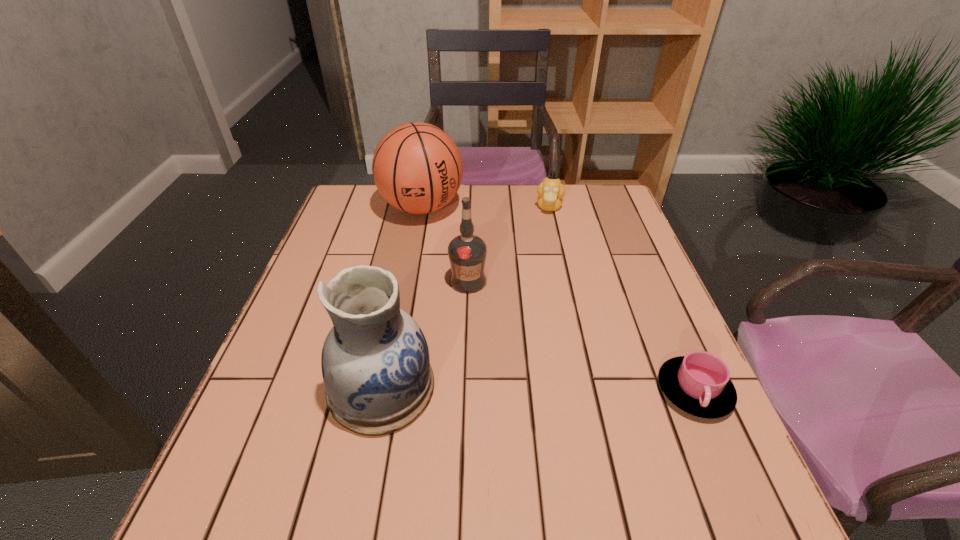
Where is `pottery`? The height and width of the screenshot is (540, 960). pottery is located at coordinates (375, 362).

This screenshot has height=540, width=960. I want to click on the rightmost object, so click(x=698, y=383).

Find the location of a particular element. The width and height of the screenshot is (960, 540). the shortest object is located at coordinates (698, 383).

Where is `basketball`? The width and height of the screenshot is (960, 540). basketball is located at coordinates (417, 168).

The width and height of the screenshot is (960, 540). In order to click on the third nearest object in this screenshot , I will do `click(467, 252)`.

The width and height of the screenshot is (960, 540). Identify the location of the fourth object from left to right. (550, 192).

This screenshot has height=540, width=960. I want to click on the second shortest object, so click(550, 192).

The image size is (960, 540). I want to click on vacant space located on the back of the pottery, so click(396, 313).

I want to click on free space located 0.060m on the side with the handle of the shortest object, so click(722, 455).

The height and width of the screenshot is (540, 960). In order to click on vacant area located on the surface of the basketball near the brand logo in this screenshot , I will do `click(474, 298)`.